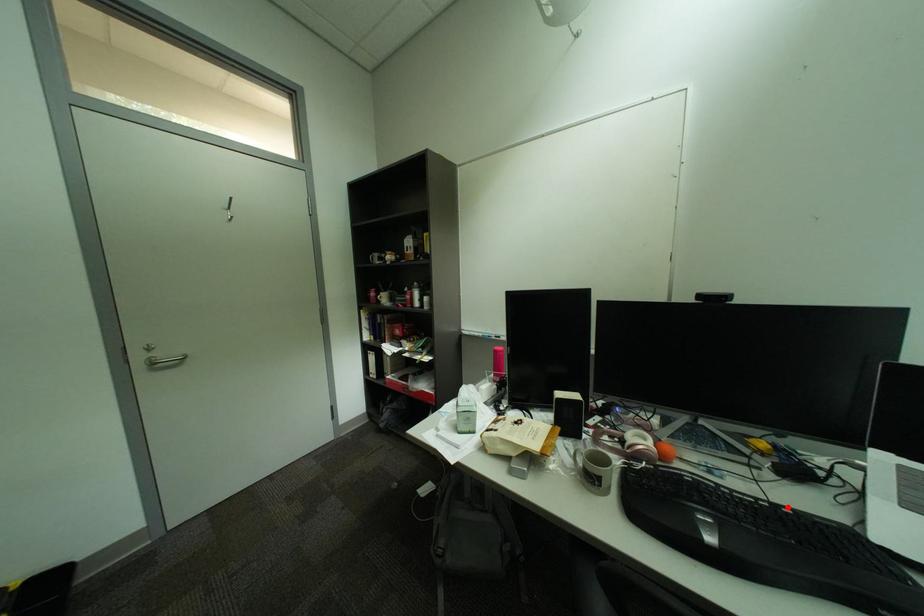
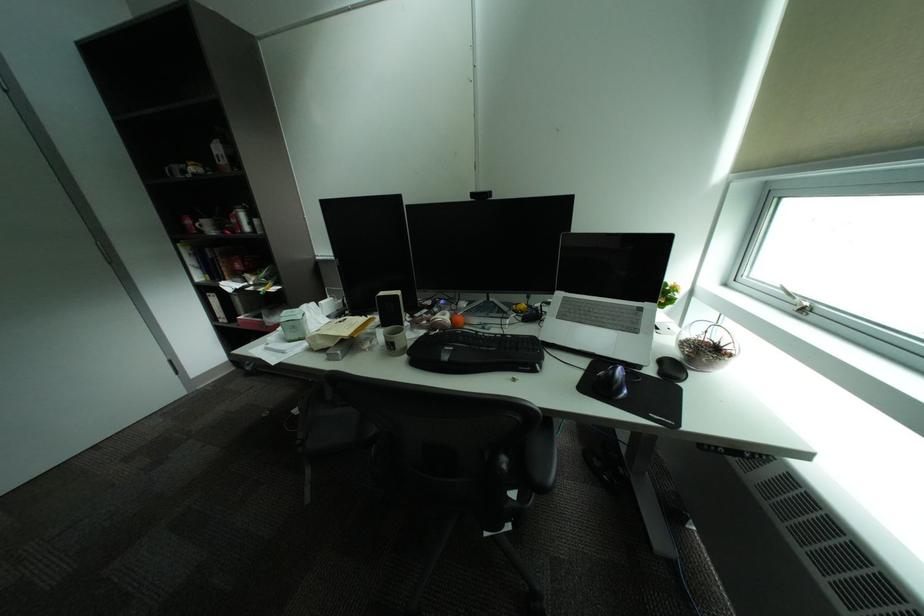
The point at the highlighted location is marked in the first image. Where is the corresponding point in the second image?

(516, 336)